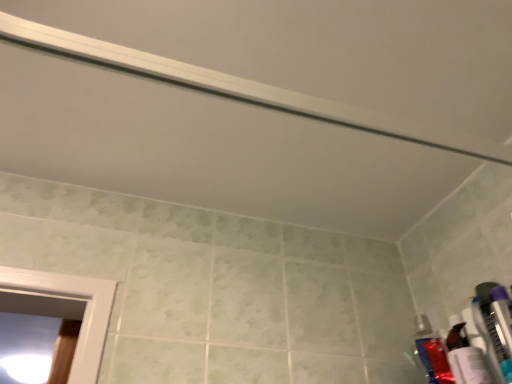
The height and width of the screenshot is (384, 512). What do you see at coordinates (434, 360) in the screenshot?
I see `matte plastic toothpaste tube at right, which is counted as the fourth toiletry, starting from the front` at bounding box center [434, 360].

What do you see at coordinates (495, 327) in the screenshot?
I see `translucent plastic toothbrush at lower right, which appears as the 2th toiletry when viewed from the front` at bounding box center [495, 327].

At what (x,y) coordinates should I click in order to perform the action: click on matte plastic toothpaste tube at right, the 1th toiletry viewed from the back. Please return your answer as a coordinate pair (x, y). Looking at the image, I should click on [434, 360].

Who is shorter, purple plastic toothbrush at right, placed as the 1th toiletry when sorted from front to back, or translucent plastic toothbrush at lower right, which appears as the 2th toiletry when viewed from the front?

purple plastic toothbrush at right, placed as the 1th toiletry when sorted from front to back, is shorter.

From the picture: Which is more to the left, purple plastic toothbrush at right, placed as the 1th toiletry when sorted from front to back, or translucent plastic toothbrush at lower right, which is counted as the third toiletry, starting from the back?

Positioned to the left is translucent plastic toothbrush at lower right, which is counted as the third toiletry, starting from the back.

Are purple plastic toothbrush at right, arranged as the fourth toiletry when viewed from the back, and translucent plastic toothbrush at lower right, which appears as the 2th toiletry when viewed from the front, far apart?

No.

From the picture: From a real-world perspective, is purple plastic toothbrush at right, arranged as the fourth toiletry when viewed from the back, on translucent plastic toothpaste tube at lower right, which is counted as the 2th toiletry, starting from the back?

No, from a real-world perspective, purple plastic toothbrush at right, arranged as the fourth toiletry when viewed from the back, is not over translucent plastic toothpaste tube at lower right, which is counted as the 2th toiletry, starting from the back

Which object is positioned more to the right, purple plastic toothbrush at right, arranged as the fourth toiletry when viewed from the back, or translucent plastic toothpaste tube at lower right, which is counted as the 2th toiletry, starting from the back?

purple plastic toothbrush at right, arranged as the fourth toiletry when viewed from the back, is more to the right.

Is purple plastic toothbrush at right, arranged as the fourth toiletry when viewed from the back, inside or outside of translucent plastic toothpaste tube at lower right, which is counted as the 2th toiletry, starting from the back?

purple plastic toothbrush at right, arranged as the fourth toiletry when viewed from the back, is not enclosed by translucent plastic toothpaste tube at lower right, which is counted as the 2th toiletry, starting from the back.

The image size is (512, 384). I want to click on the 2nd toiletry to the left of the purple plastic toothbrush at right, placed as the 1th toiletry when sorted from front to back, counting from the anchor's position, so click(x=484, y=340).

Considering the positions of objects translucent plastic toothbrush at lower right, which is counted as the third toiletry, starting from the back, and purple plastic toothbrush at right, placed as the 1th toiletry when sorted from front to back, in the image provided, who is more to the left, translucent plastic toothbrush at lower right, which is counted as the third toiletry, starting from the back, or purple plastic toothbrush at right, placed as the 1th toiletry when sorted from front to back,?

translucent plastic toothbrush at lower right, which is counted as the third toiletry, starting from the back, is more to the left.

From a real-world perspective, which is physically below, translucent plastic toothbrush at lower right, which is counted as the third toiletry, starting from the back, or purple plastic toothbrush at right, arranged as the fourth toiletry when viewed from the back?

In real-world perspective, purple plastic toothbrush at right, arranged as the fourth toiletry when viewed from the back, is lower.

Is point (483, 308) more distant than point (507, 333)?

Yes, point (483, 308) is behind point (507, 333).

Does translucent plastic toothbrush at lower right, which appears as the 2th toiletry when viewed from the front, turn towards purple plastic toothbrush at right, placed as the 1th toiletry when sorted from front to back?

No, translucent plastic toothbrush at lower right, which appears as the 2th toiletry when viewed from the front, is not aimed at purple plastic toothbrush at right, placed as the 1th toiletry when sorted from front to back.

Based on the photo, in the image, is purple plastic toothbrush at right, placed as the 1th toiletry when sorted from front to back, positioned in front of or behind matte plastic toothpaste tube at right, the 1th toiletry viewed from the back?

purple plastic toothbrush at right, placed as the 1th toiletry when sorted from front to back, is positioned closer to the viewer than matte plastic toothpaste tube at right, the 1th toiletry viewed from the back.

From the image's perspective, which is below, purple plastic toothbrush at right, arranged as the fourth toiletry when viewed from the back, or matte plastic toothpaste tube at right, which is counted as the fourth toiletry, starting from the front?

matte plastic toothpaste tube at right, which is counted as the fourth toiletry, starting from the front.

From a real-world perspective, who is located higher, purple plastic toothbrush at right, arranged as the fourth toiletry when viewed from the back, or matte plastic toothpaste tube at right, the 1th toiletry viewed from the back?

From a 3D spatial view, matte plastic toothpaste tube at right, the 1th toiletry viewed from the back, is above.

Which point is more distant from viewer, (510, 331) or (435, 357)?

The point (435, 357) is behind.

Which of these two, matte plastic toothpaste tube at right, which is counted as the fourth toiletry, starting from the front, or translucent plastic toothbrush at lower right, which is counted as the third toiletry, starting from the back, stands taller?

Standing taller between the two is matte plastic toothpaste tube at right, which is counted as the fourth toiletry, starting from the front.

The image size is (512, 384). There is a translucent plastic toothbrush at lower right, which appears as the 2th toiletry when viewed from the front. In order to click on the 2nd toiletry below it (from the image's perspective) in this screenshot , I will do `click(434, 360)`.

Would you consider matte plastic toothpaste tube at right, which is counted as the fourth toiletry, starting from the front, to be distant from translucent plastic toothbrush at lower right, which is counted as the third toiletry, starting from the back?

matte plastic toothpaste tube at right, which is counted as the fourth toiletry, starting from the front, is actually quite close to translucent plastic toothbrush at lower right, which is counted as the third toiletry, starting from the back.

From the image's perspective, relative to translucent plastic toothpaste tube at lower right, acting as the 3th toiletry starting from the front, is matte plastic toothpaste tube at right, the 1th toiletry viewed from the back, above or below?

Clearly, from the image's perspective, matte plastic toothpaste tube at right, the 1th toiletry viewed from the back, is below translucent plastic toothpaste tube at lower right, acting as the 3th toiletry starting from the front.

Between matte plastic toothpaste tube at right, the 1th toiletry viewed from the back, and translucent plastic toothpaste tube at lower right, which is counted as the 2th toiletry, starting from the back, which one appears on the right side from the viewer's perspective?

From the viewer's perspective, translucent plastic toothpaste tube at lower right, which is counted as the 2th toiletry, starting from the back, appears more on the right side.

In terms of height, does matte plastic toothpaste tube at right, which is counted as the fourth toiletry, starting from the front, look taller or shorter compared to translucent plastic toothpaste tube at lower right, acting as the 3th toiletry starting from the front?

matte plastic toothpaste tube at right, which is counted as the fourth toiletry, starting from the front, is shorter than translucent plastic toothpaste tube at lower right, acting as the 3th toiletry starting from the front.

You are a GUI agent. You are given a task and a screenshot of the screen. Output one action in this format:
    pyautogui.click(x=<x>, y=<y>)
    Task: Click on the 3rd toiletry below the matte plastic toothpaste tube at right, the 1th toiletry viewed from the back (from a real-world perspective)
    Image resolution: width=512 pixels, height=384 pixels.
    Given the screenshot: What is the action you would take?
    pyautogui.click(x=502, y=317)

Looking at this image, is matte plastic toothpaste tube at right, which is counted as the fourth toiletry, starting from the front, smaller than purple plastic toothbrush at right, placed as the 1th toiletry when sorted from front to back?

Incorrect, matte plastic toothpaste tube at right, which is counted as the fourth toiletry, starting from the front, is not smaller in size than purple plastic toothbrush at right, placed as the 1th toiletry when sorted from front to back.

Would you say matte plastic toothpaste tube at right, which is counted as the fourth toiletry, starting from the front, contains purple plastic toothbrush at right, arranged as the fourth toiletry when viewed from the back?

That's incorrect, purple plastic toothbrush at right, arranged as the fourth toiletry when viewed from the back, is not inside matte plastic toothpaste tube at right, which is counted as the fourth toiletry, starting from the front.

Is matte plastic toothpaste tube at right, the 1th toiletry viewed from the back, touching purple plastic toothbrush at right, placed as the 1th toiletry when sorted from front to back?

No, matte plastic toothpaste tube at right, the 1th toiletry viewed from the back, is not beside purple plastic toothbrush at right, placed as the 1th toiletry when sorted from front to back.

Find the location of `toiletry in front of the translucent plastic toothbrush at lower right, which appears as the 2th toiletry when viewed from the front`. toiletry in front of the translucent plastic toothbrush at lower right, which appears as the 2th toiletry when viewed from the front is located at coordinates (502, 317).

From a real-world perspective, starting from the purple plastic toothbrush at right, placed as the 1th toiletry when sorted from front to back, which toiletry is the 2nd one vertically above it? Please provide its 2D coordinates.

[(484, 340)]

When comparing their distances from purple plastic toothbrush at right, arranged as the fourth toiletry when viewed from the back, does translucent plastic toothbrush at lower right, which appears as the 2th toiletry when viewed from the front, or matte plastic toothpaste tube at right, which is counted as the fourth toiletry, starting from the front, seem closer?

→ translucent plastic toothbrush at lower right, which appears as the 2th toiletry when viewed from the front, is closer to purple plastic toothbrush at right, arranged as the fourth toiletry when viewed from the back.

Estimate the real-world distances between objects in this image. Which object is further from translucent plastic toothbrush at lower right, which appears as the 2th toiletry when viewed from the front, translucent plastic toothpaste tube at lower right, acting as the 3th toiletry starting from the front, or matte plastic toothpaste tube at right, which is counted as the fourth toiletry, starting from the front?

matte plastic toothpaste tube at right, which is counted as the fourth toiletry, starting from the front, is positioned further to the anchor translucent plastic toothbrush at lower right, which appears as the 2th toiletry when viewed from the front.

Considering their positions, is translucent plastic toothbrush at lower right, which appears as the 2th toiletry when viewed from the front, positioned further to purple plastic toothbrush at right, placed as the 1th toiletry when sorted from front to back, than translucent plastic toothpaste tube at lower right, which is counted as the 2th toiletry, starting from the back?

translucent plastic toothpaste tube at lower right, which is counted as the 2th toiletry, starting from the back.

From the picture: Looking at the image, which one is located closer to translucent plastic toothpaste tube at lower right, which is counted as the 2th toiletry, starting from the back, purple plastic toothbrush at right, placed as the 1th toiletry when sorted from front to back, or matte plastic toothpaste tube at right, which is counted as the fourth toiletry, starting from the front?

purple plastic toothbrush at right, placed as the 1th toiletry when sorted from front to back.

Which object lies further to the anchor point matte plastic toothpaste tube at right, the 1th toiletry viewed from the back, purple plastic toothbrush at right, placed as the 1th toiletry when sorted from front to back, or translucent plastic toothpaste tube at lower right, which is counted as the 2th toiletry, starting from the back?

purple plastic toothbrush at right, placed as the 1th toiletry when sorted from front to back, is positioned further to the anchor matte plastic toothpaste tube at right, the 1th toiletry viewed from the back.

Which object lies further to the anchor point translucent plastic toothbrush at lower right, which is counted as the third toiletry, starting from the back, purple plastic toothbrush at right, placed as the 1th toiletry when sorted from front to back, or matte plastic toothpaste tube at right, the 1th toiletry viewed from the back?

The object further to translucent plastic toothbrush at lower right, which is counted as the third toiletry, starting from the back, is matte plastic toothpaste tube at right, the 1th toiletry viewed from the back.

From the picture: From the image, which object appears to be nearer to translucent plastic toothbrush at lower right, which is counted as the third toiletry, starting from the back, translucent plastic toothpaste tube at lower right, acting as the 3th toiletry starting from the front, or purple plastic toothbrush at right, placed as the 1th toiletry when sorted from front to back?

The object closer to translucent plastic toothbrush at lower right, which is counted as the third toiletry, starting from the back, is translucent plastic toothpaste tube at lower right, acting as the 3th toiletry starting from the front.

Which object lies further to the anchor point purple plastic toothbrush at right, placed as the 1th toiletry when sorted from front to back, translucent plastic toothpaste tube at lower right, acting as the 3th toiletry starting from the front, or matte plastic toothpaste tube at right, the 1th toiletry viewed from the back?

matte plastic toothpaste tube at right, the 1th toiletry viewed from the back, is further to purple plastic toothbrush at right, placed as the 1th toiletry when sorted from front to back.

The height and width of the screenshot is (384, 512). In order to click on toiletry positioned between translucent plastic toothbrush at lower right, which appears as the 2th toiletry when viewed from the front, and matte plastic toothpaste tube at right, which is counted as the fourth toiletry, starting from the front, from near to far in this screenshot , I will do `click(484, 340)`.

Image resolution: width=512 pixels, height=384 pixels. In order to click on toiletry between purple plastic toothbrush at right, placed as the 1th toiletry when sorted from front to back, and translucent plastic toothpaste tube at lower right, which is counted as the 2th toiletry, starting from the back, from front to back in this screenshot , I will do `click(495, 327)`.